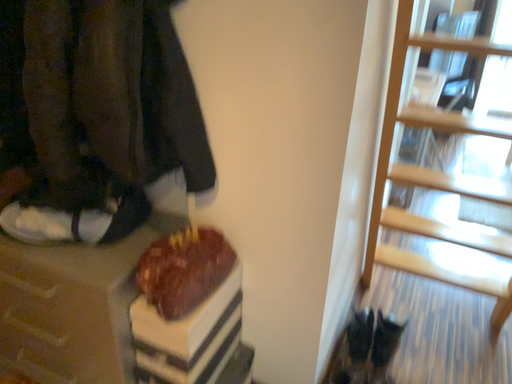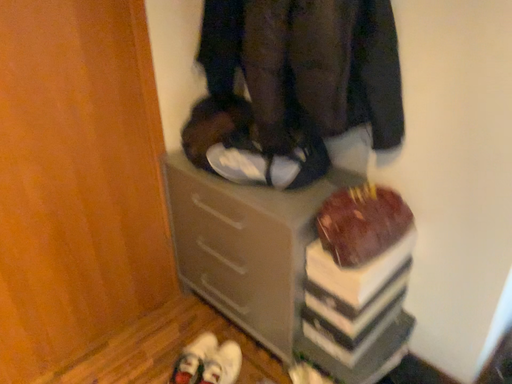
Question: Which way did the camera rotate in the video?

Choices:
 (A) rotated left
 (B) rotated right

Answer: (A)